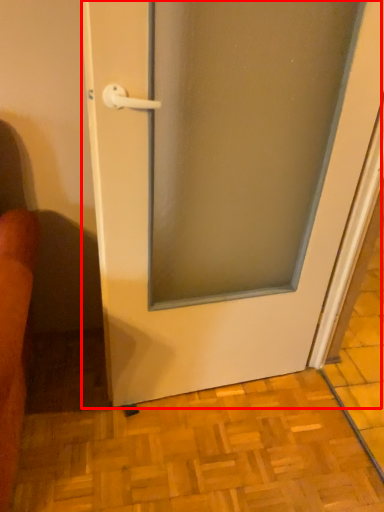
Question: From the image's perspective, where is door (annotated by the red box) located relative to tile?

Choices:
 (A) below
 (B) above

Answer: (B)